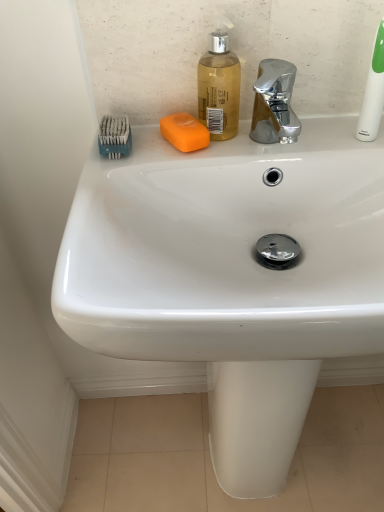
Question: Is white plastic toothbrush at upper right to the left of teal plastic toothbrush at upper left from the viewer's perspective?

Choices:
 (A) no
 (B) yes

Answer: (A)

Question: Is white plastic toothbrush at upper right closer to the viewer compared to teal plastic toothbrush at upper left?

Choices:
 (A) yes
 (B) no

Answer: (A)

Question: From the image's perspective, does white plastic toothbrush at upper right appear higher than teal plastic toothbrush at upper left?

Choices:
 (A) no
 (B) yes

Answer: (B)

Question: Does white plastic toothbrush at upper right turn towards teal plastic toothbrush at upper left?

Choices:
 (A) no
 (B) yes

Answer: (A)

Question: Can you see white plastic toothbrush at upper right touching teal plastic toothbrush at upper left?

Choices:
 (A) no
 (B) yes

Answer: (A)

Question: Based on their positions, is translucent plastic soap dispenser at upper center located to the left or right of white plastic toothbrush at upper right?

Choices:
 (A) left
 (B) right

Answer: (A)

Question: From a real-world perspective, is translucent plastic soap dispenser at upper center positioned above or below white plastic toothbrush at upper right?

Choices:
 (A) above
 (B) below

Answer: (B)

Question: Is point (235, 87) closer or farther from the camera than point (375, 117)?

Choices:
 (A) farther
 (B) closer

Answer: (A)

Question: In terms of width, does translucent plastic soap dispenser at upper center look wider or thinner when compared to white plastic toothbrush at upper right?

Choices:
 (A) wide
 (B) thin

Answer: (A)

Question: Considering their positions, is teal plastic toothbrush at upper left located in front of or behind orange matte soap at center?

Choices:
 (A) behind
 (B) front

Answer: (B)

Question: Is teal plastic toothbrush at upper left wider or thinner than orange matte soap at center?

Choices:
 (A) wide
 (B) thin

Answer: (B)

Question: Based on their sizes in the image, would you say teal plastic toothbrush at upper left is bigger or smaller than orange matte soap at center?

Choices:
 (A) big
 (B) small

Answer: (A)

Question: Based on their positions, is teal plastic toothbrush at upper left located to the left or right of orange matte soap at center?

Choices:
 (A) left
 (B) right

Answer: (A)

Question: Relative to translucent plastic soap dispenser at upper center, is white plastic toothbrush at upper right in front or behind?

Choices:
 (A) front
 (B) behind

Answer: (A)

Question: Is white plastic toothbrush at upper right wider or thinner than translucent plastic soap dispenser at upper center?

Choices:
 (A) thin
 (B) wide

Answer: (A)